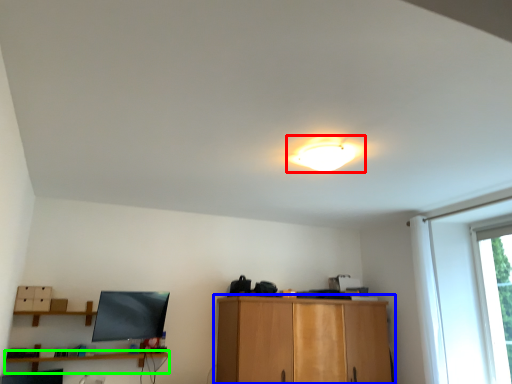
Question: Which object is the closest to the lamp (highlighted by a red box)? Choose among these: cabinetry (highlighted by a blue box) or shelf (highlighted by a green box).

Choices:
 (A) cabinetry
 (B) shelf

Answer: (A)